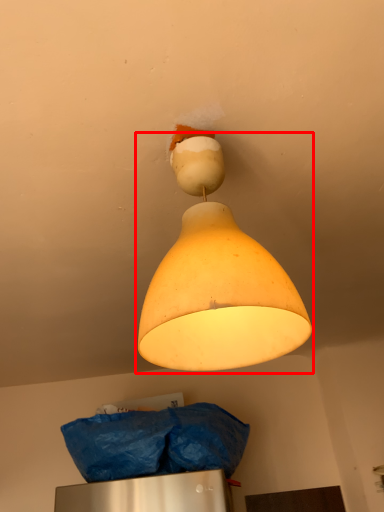
Question: From the image, what is the correct spatial relationship of lamp (annotated by the red box) in relation to material?

Choices:
 (A) right
 (B) left

Answer: (A)